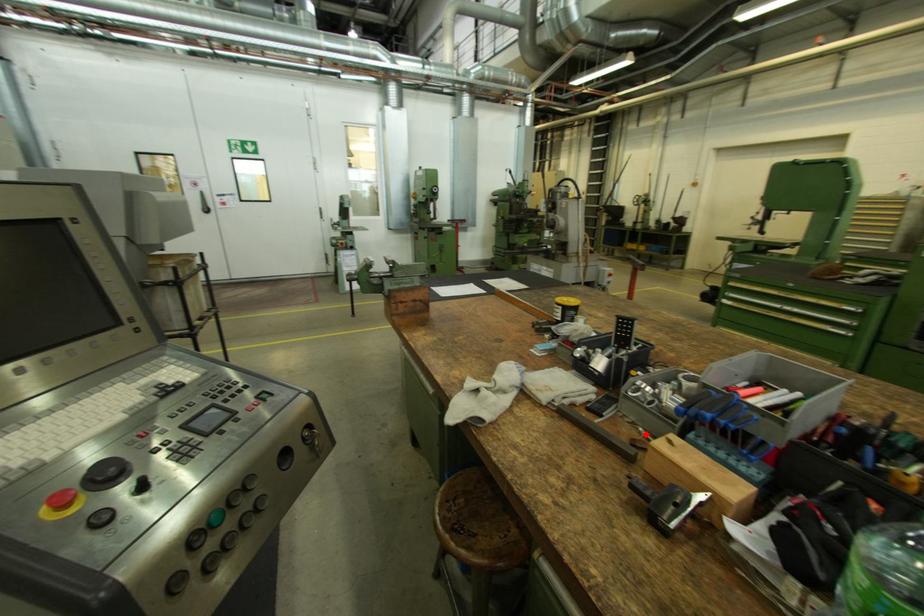
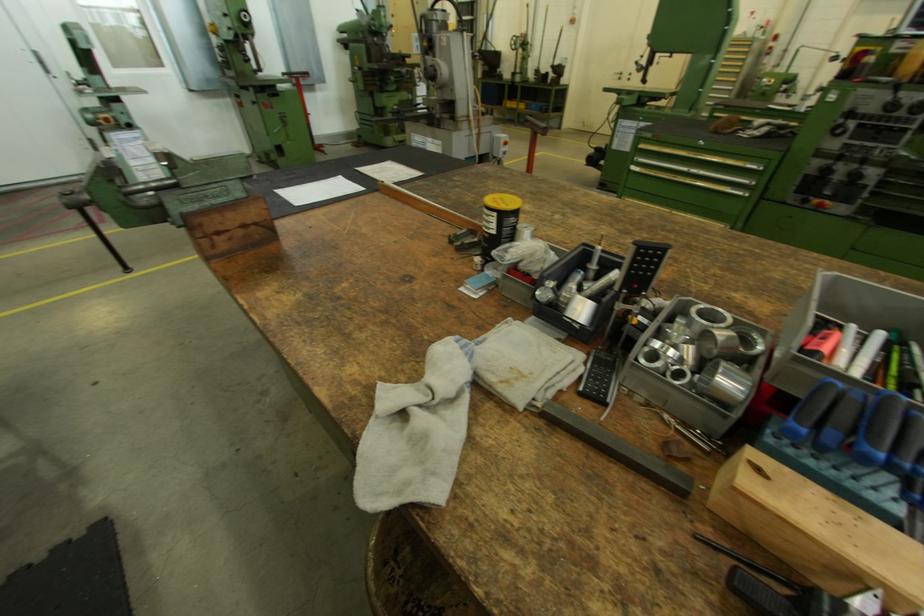
The point at the highlighted location is marked in the first image. Where is the corresponding point in the second image?

(673, 424)